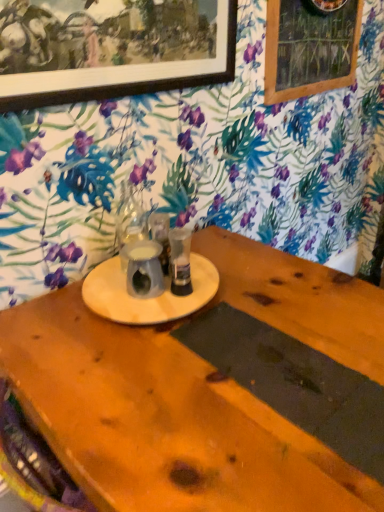
At what (x,y) coordinates should I click in order to perform the action: click on vacant position to the left of translucent glass vase at center, the second tableware from the right. Please return your answer as a coordinate pair (x, y). Looking at the image, I should click on (104, 274).